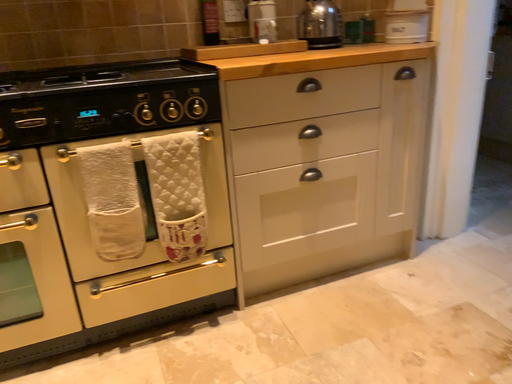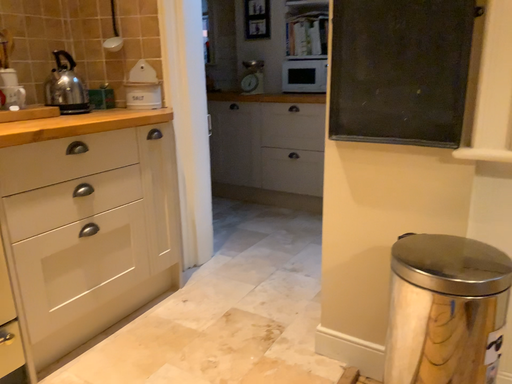
Question: How did the camera likely rotate when shooting the video?

Choices:
 (A) rotated upward
 (B) rotated downward

Answer: (A)